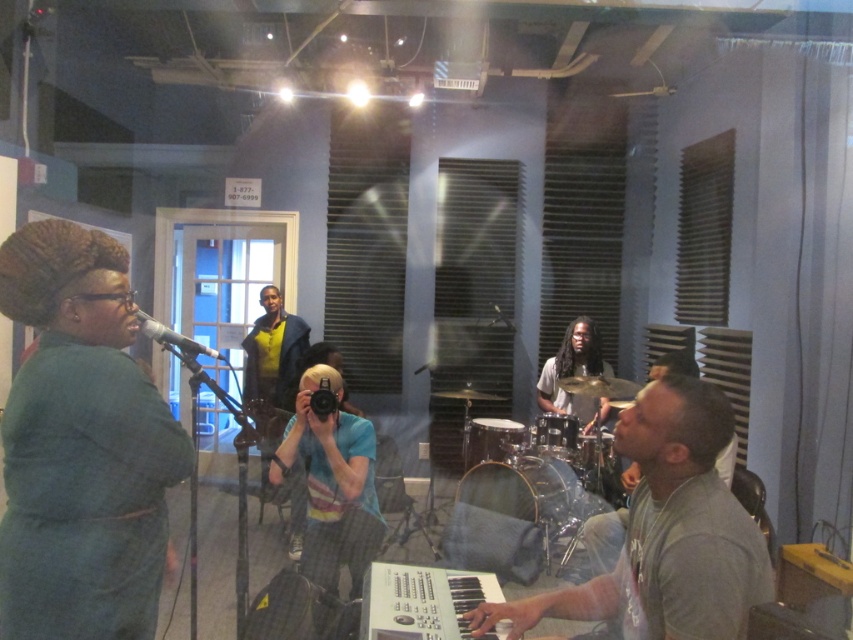
Question: Does matte black microphone at left appear under shiny metallic drum at center?

Choices:
 (A) no
 (B) yes

Answer: (A)

Question: Can you confirm if matte black drum at center is positioned to the left of black drum at center?

Choices:
 (A) no
 (B) yes

Answer: (B)

Question: Which point is closer to the camera?

Choices:
 (A) gray matte shirt at lower right
 (B) green matte coat at left
 (C) matte black microphone at left
 (D) black matte microphone at center

Answer: (A)

Question: Which object appears farthest from the camera in this image?

Choices:
 (A) matte black drum at center
 (B) shiny silver drum at center

Answer: (A)

Question: Is matte black drum at center bigger than black matte microphone at center?

Choices:
 (A) yes
 (B) no

Answer: (A)

Question: Which object is closer to the camera taking this photo?

Choices:
 (A) shiny metallic drum at center
 (B) matte black microphone at left
 (C) matte black drum at center
 (D) black drum at center

Answer: (B)